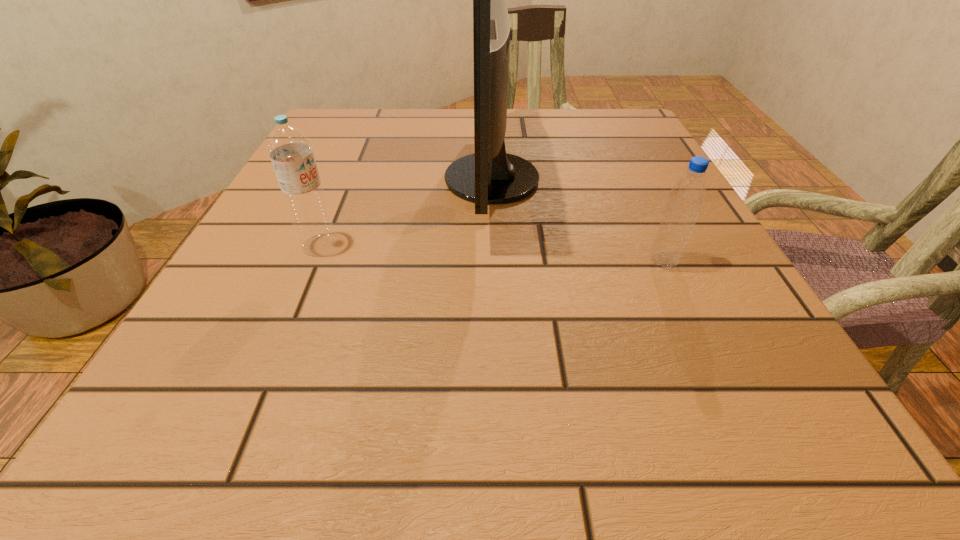
At what (x,y) coordinates should I click in order to perform the action: click on object that can be found as the second closest to the second shortest object. Please return your answer as a coordinate pair (x, y). The height and width of the screenshot is (540, 960). Looking at the image, I should click on (687, 196).

Locate an element on the screen. The image size is (960, 540). free location that satisfies the following two spatial constraints: 1. on the screen side of the right water bottle; 2. on the right side of the second object from left to right is located at coordinates coord(494,262).

In order to click on free space in the image that satisfies the following two spatial constraints: 1. on the screen side of the tallest object; 2. on the back side of the shortest object in this screenshot , I will do `click(494, 262)`.

You are a GUI agent. You are given a task and a screenshot of the screen. Output one action in this format:
    pyautogui.click(x=<x>, y=<y>)
    Task: Click on the free location that satisfies the following two spatial constraints: 1. on the back side of the shortest object; 2. on the screen side of the monitor
    The height and width of the screenshot is (540, 960).
    Given the screenshot: What is the action you would take?
    pyautogui.click(x=625, y=179)

Where is `vacant region that satisfies the following two spatial constraints: 1. on the back side of the shorter water bottle; 2. on the screen side of the tallest object`? vacant region that satisfies the following two spatial constraints: 1. on the back side of the shorter water bottle; 2. on the screen side of the tallest object is located at coordinates (625, 179).

You are a GUI agent. You are given a task and a screenshot of the screen. Output one action in this format:
    pyautogui.click(x=<x>, y=<y>)
    Task: Click on the free space that satisfies the following two spatial constraints: 1. on the screen side of the monitor; 2. on the right side of the shortest object
    The image size is (960, 540).
    Given the screenshot: What is the action you would take?
    pyautogui.click(x=494, y=262)

Locate an element on the screen. Image resolution: width=960 pixels, height=540 pixels. vacant space that satisfies the following two spatial constraints: 1. on the screen side of the second object from right to left; 2. on the back side of the shorter water bottle is located at coordinates (494, 262).

This screenshot has height=540, width=960. Identify the location of free space that satisfies the following two spatial constraints: 1. on the screen side of the tallest object; 2. on the right side of the right water bottle. (494, 262).